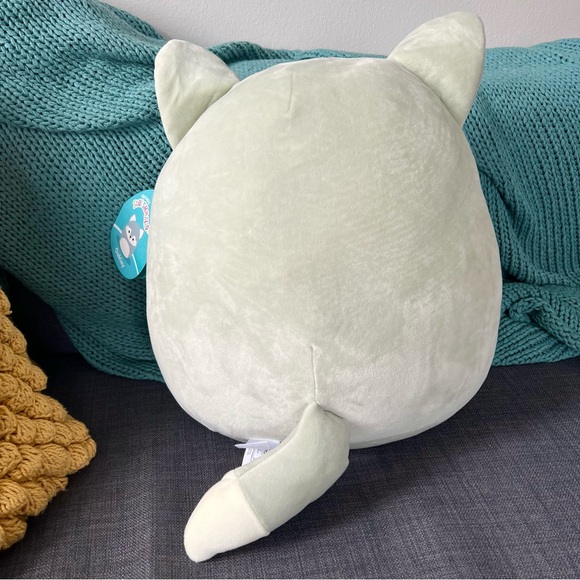
This screenshot has height=580, width=580. Find the location of `wall`. wall is located at coordinates (253, 18).